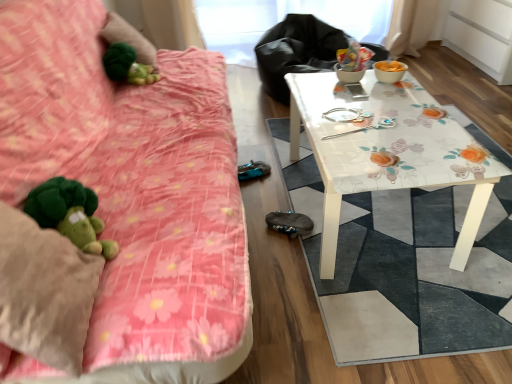
Question: Considering the relative sizes of floral-patterned table at right and floral glass table at center in the image provided, is floral-patterned table at right shorter than floral glass table at center?

Choices:
 (A) no
 (B) yes

Answer: (A)

Question: Does floral-patterned table at right appear on the left side of floral glass table at center?

Choices:
 (A) yes
 (B) no

Answer: (B)

Question: Is floral-patterned table at right not within floral glass table at center?

Choices:
 (A) yes
 (B) no

Answer: (A)

Question: Is floral-patterned table at right facing towards floral glass table at center?

Choices:
 (A) yes
 (B) no

Answer: (B)

Question: Can you confirm if floral-patterned table at right is wider than floral glass table at center?

Choices:
 (A) no
 (B) yes

Answer: (B)

Question: From the image's perspective, is floral-patterned table at right on top of floral glass table at center?

Choices:
 (A) yes
 (B) no

Answer: (A)

Question: From the image's perspective, is fluffy pink blanket at left located beneath green plush at upper left?

Choices:
 (A) no
 (B) yes

Answer: (B)

Question: Does fluffy pink blanket at left lie behind green plush at upper left?

Choices:
 (A) yes
 (B) no

Answer: (B)

Question: Does fluffy pink blanket at left turn towards green plush at upper left?

Choices:
 (A) no
 (B) yes

Answer: (A)

Question: Can you confirm if fluffy pink blanket at left is smaller than green plush at upper left?

Choices:
 (A) yes
 (B) no

Answer: (B)

Question: From the image's perspective, does fluffy pink blanket at left appear higher than green plush at upper left?

Choices:
 (A) no
 (B) yes

Answer: (A)

Question: Can you confirm if fluffy pink blanket at left is positioned to the left of green plush at upper left?

Choices:
 (A) no
 (B) yes

Answer: (A)

Question: Does green plush at upper left have a greater width compared to floral glass table at center?

Choices:
 (A) yes
 (B) no

Answer: (B)